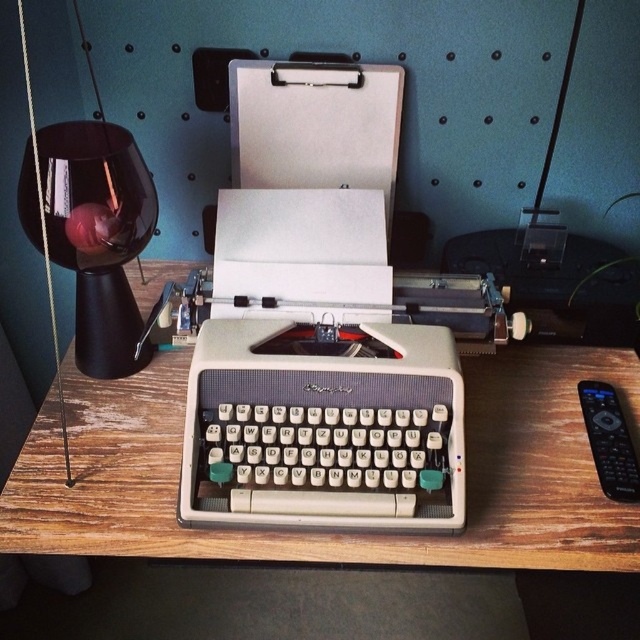
Can you confirm if wooden table at center is positioned to the right of black glass table lamp at left?

Correct, you'll find wooden table at center to the right of black glass table lamp at left.

Who is more forward, (172, 260) or (29, 180)?

Point (29, 180) is in front.

Is point (468, 557) positioned after point (33, 221)?

That is False.

The width and height of the screenshot is (640, 640). In order to click on wooden table at center in this screenshot , I will do `click(333, 531)`.

Does wooden table at center have a lesser height compared to black plastic remote at right?

In fact, wooden table at center may be taller than black plastic remote at right.

Is wooden table at center in front of black plastic remote at right?

Yes, wooden table at center is in front of black plastic remote at right.

Between point (200, 554) and point (584, 403), which one is positioned behind?

Positioned behind is point (584, 403).

Where is `wooden table at center`? wooden table at center is located at coordinates (333, 531).

Who is lower down, black glass table lamp at left or black plastic remote at right?

Positioned lower is black plastic remote at right.

Between black glass table lamp at left and black plastic remote at right, which one has more height?

With more height is black glass table lamp at left.

Measure the distance between point (68, 220) and camera.

A distance of 32.04 inches exists between point (68, 220) and camera.

Find the location of a particular element. black glass table lamp at left is located at coordinates (99, 234).